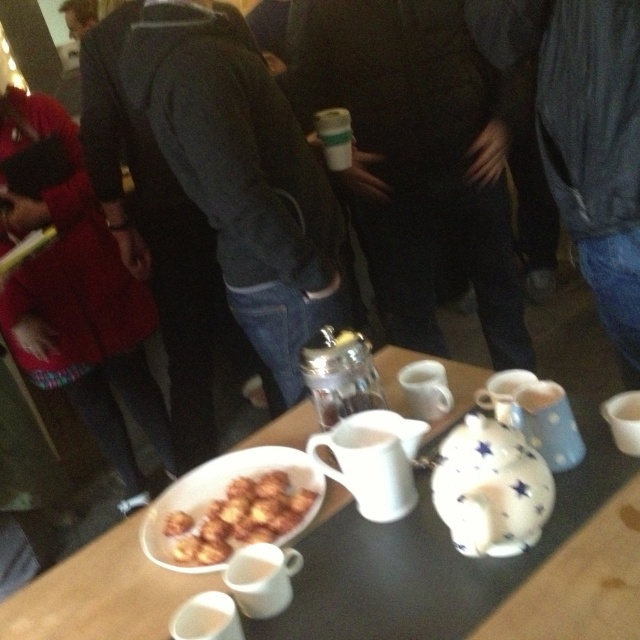
You are at a social gathering and want to take a photo of the point at coordinates point (516, 388). The camera you are using has a minimum focus distance of 35 inches. Will the point be in focus?

The point (516, 388) is 37.81 inches from the camera, which is beyond the minimum focus distance of 35 inches. Therefore, the point will be in focus.